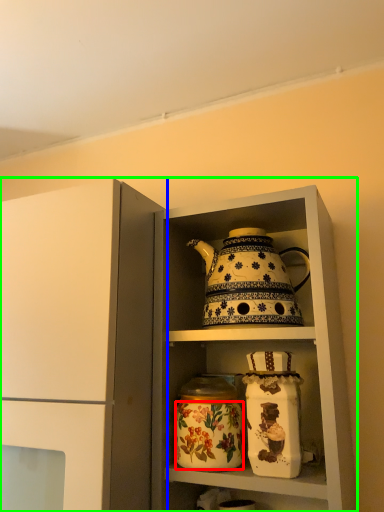
Question: Considering the real-world distances, which object is farthest from flower (highlighted by a red box)? cupboard (highlighted by a blue box) or cabinetry (highlighted by a green box)?

Choices:
 (A) cupboard
 (B) cabinetry

Answer: (A)